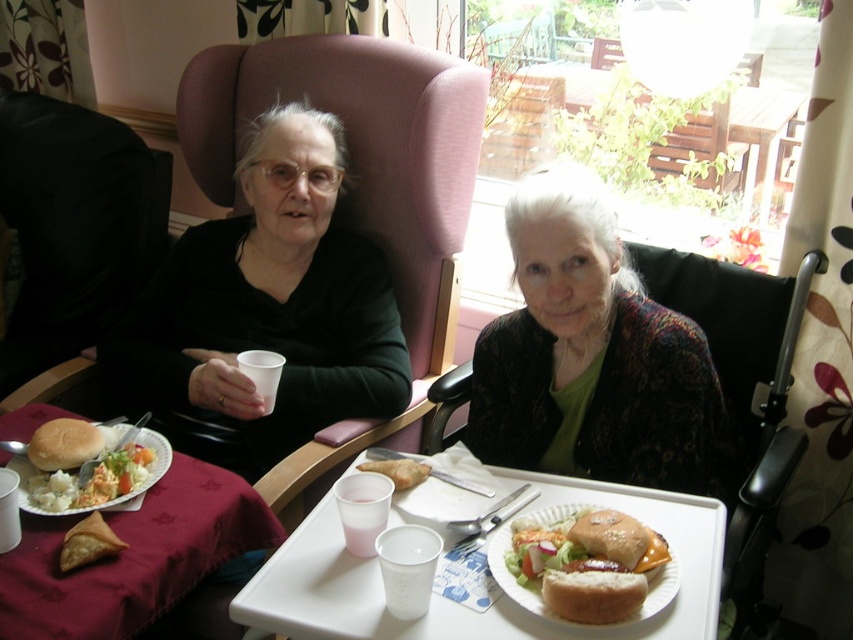
Which of these two, matte black cup at left or breaded bun at lower center, stands shorter?

With less height is breaded bun at lower center.

In the scene shown: Is matte black cup at left bigger than breaded bun at lower center?

Yes, matte black cup at left is bigger than breaded bun at lower center.

Between point (93, 310) and point (572, 592), which one is positioned behind?

The point (93, 310) is behind.

This screenshot has width=853, height=640. In order to click on matte black cup at left in this screenshot , I will do `click(73, 227)`.

Is point (271, 193) closer to viewer compared to point (76, 481)?

No, it is behind (76, 481).

Which is in front, point (209, 385) or point (144, 419)?

Positioned in front is point (144, 419).

This screenshot has height=640, width=853. What do you see at coordinates (265, 310) in the screenshot?
I see `matte black sweater at upper left` at bounding box center [265, 310].

At what (x,y) coordinates should I click in order to perform the action: click on matte black sweater at upper left. Please return your answer as a coordinate pair (x, y). The height and width of the screenshot is (640, 853). Looking at the image, I should click on (265, 310).

Is white plastic tray at center positioned at the back of white paper cup at center?

No, it is not.

Does point (399, 624) come in front of point (277, 371)?

Yes, point (399, 624) is closer to viewer.

Identify the location of white plastic tray at center. The image size is (853, 640). (456, 540).